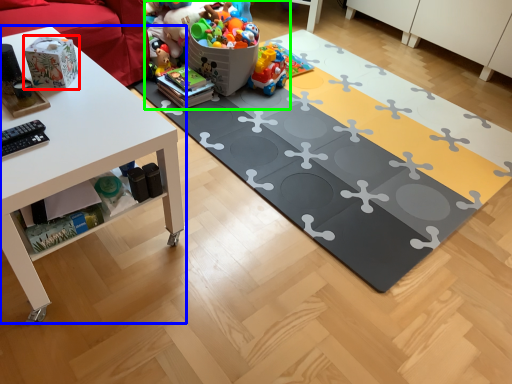
Question: Considering the real-world distances, which object is farthest from toy (highlighted by a red box)? table (highlighted by a blue box) or toy (highlighted by a green box)?

Choices:
 (A) table
 (B) toy

Answer: (B)